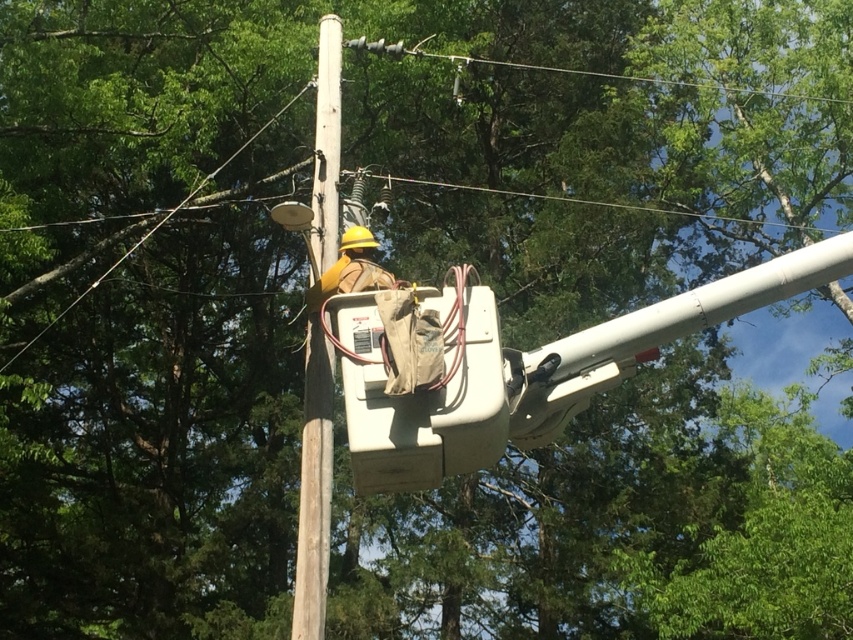
Does brown wooden telegraph pole at center appear on the right side of yellow hard hat at upper center?

In fact, brown wooden telegraph pole at center is to the left of yellow hard hat at upper center.

Between point (315, 228) and point (358, 248), which one is positioned behind?

Point (315, 228)

At what (x,y) coordinates should I click in order to perform the action: click on brown wooden telegraph pole at center. Please return your answer as a coordinate pair (x, y). This screenshot has height=640, width=853. Looking at the image, I should click on (314, 486).